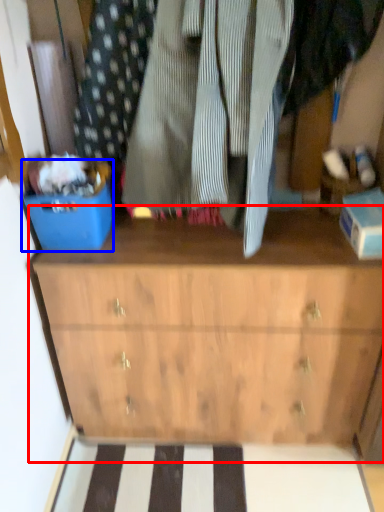
Question: Which object is further to the camera taking this photo, chest of drawers (highlighted by a red box) or storage box (highlighted by a blue box)?

Choices:
 (A) chest of drawers
 (B) storage box

Answer: (A)